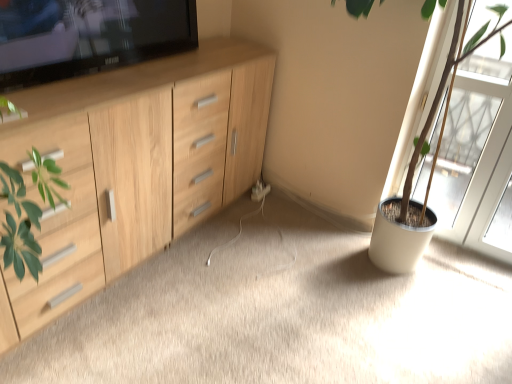
Find the location of a particular element. This screenshot has height=384, width=512. free space in front of white plastic electric outlet at center is located at coordinates (259, 214).